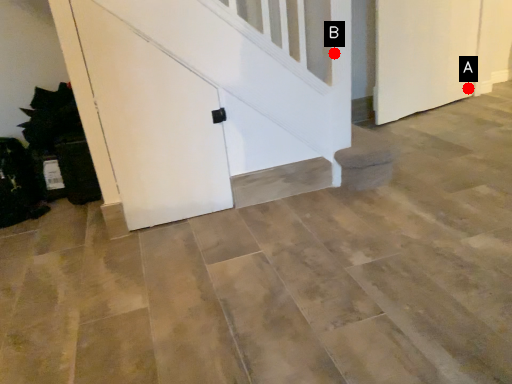
Question: Two points are circled on the image, labeled by A and B beside each circle. Which point appears farthest from the camera in this image?

Choices:
 (A) A is further
 (B) B is further

Answer: (A)